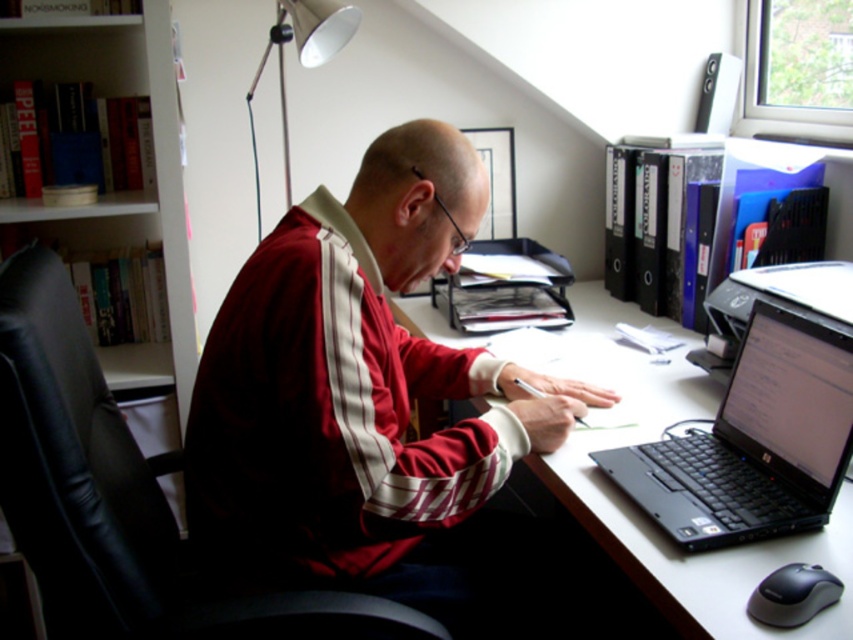
Question: Which object is closer to the camera taking this photo?

Choices:
 (A) white glossy computer desk at center
 (B) matte red tracksuit at center

Answer: (A)

Question: Among these objects, which one is farthest from the camera?

Choices:
 (A) black plastic mouse at lower right
 (B) matte red tracksuit at center

Answer: (B)

Question: Is matte red tracksuit at center to the right of matte silver lamp at upper left from the viewer's perspective?

Choices:
 (A) yes
 (B) no

Answer: (A)

Question: Is black plastic laptop at right wider than black plastic mouse at lower right?

Choices:
 (A) no
 (B) yes

Answer: (B)

Question: Which point is closer to the camera taking this photo?

Choices:
 (A) (515, 413)
 (B) (277, 60)
 (C) (96, 388)
 (D) (753, 556)

Answer: (D)

Question: Considering the relative positions of matte red tracksuit at center and black plastic mouse at lower right in the image provided, where is matte red tracksuit at center located with respect to black plastic mouse at lower right?

Choices:
 (A) left
 (B) right

Answer: (A)